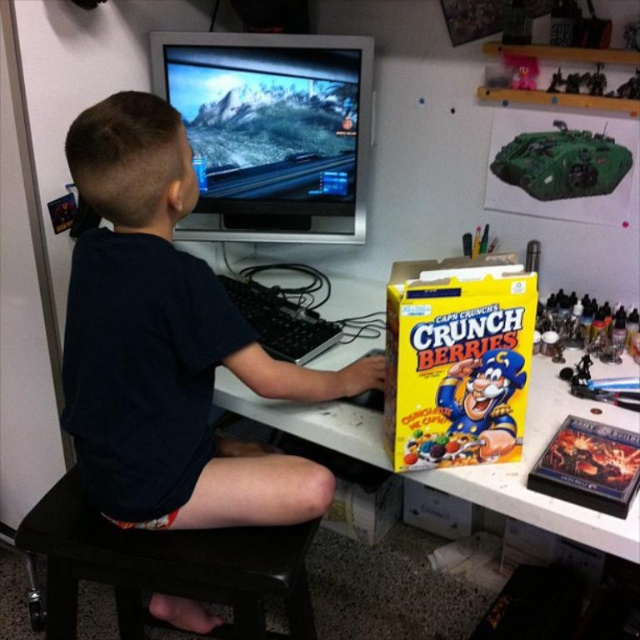
Question: Which point is closer to the camera?

Choices:
 (A) yellow cardboard box at center
 (B) dark blue shirt at center

Answer: (A)

Question: Which object appears farthest from the camera in this image?

Choices:
 (A) yellow cardboard box at center
 (B) satin black monitor at upper center
 (C) green matte tank at upper right
 (D) black leather stool at lower center

Answer: (B)

Question: Does black leather stool at lower center appear on the right side of green matte tank at upper right?

Choices:
 (A) no
 (B) yes

Answer: (A)

Question: From the image, what is the correct spatial relationship of black leather stool at lower center in relation to green matte tank at upper right?

Choices:
 (A) left
 (B) right

Answer: (A)

Question: Which point is farther from the camera taking this photo?

Choices:
 (A) (77, 513)
 (B) (253, 211)
 (C) (88, 378)

Answer: (B)

Question: Does yellow cardboard box at center lie in front of green matte tank at upper right?

Choices:
 (A) yes
 (B) no

Answer: (A)